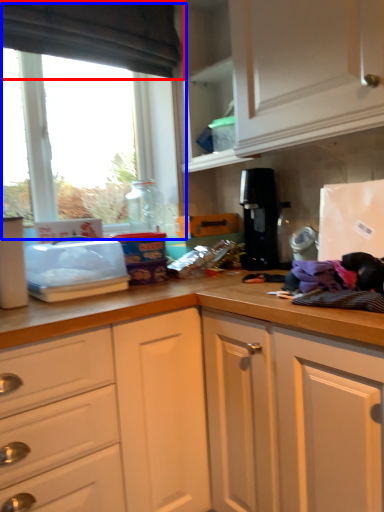
Question: Which of the following is the closest to the observer, exhaust hood (highlighted by a red box) or window (highlighted by a blue box)?

Choices:
 (A) exhaust hood
 (B) window

Answer: (A)